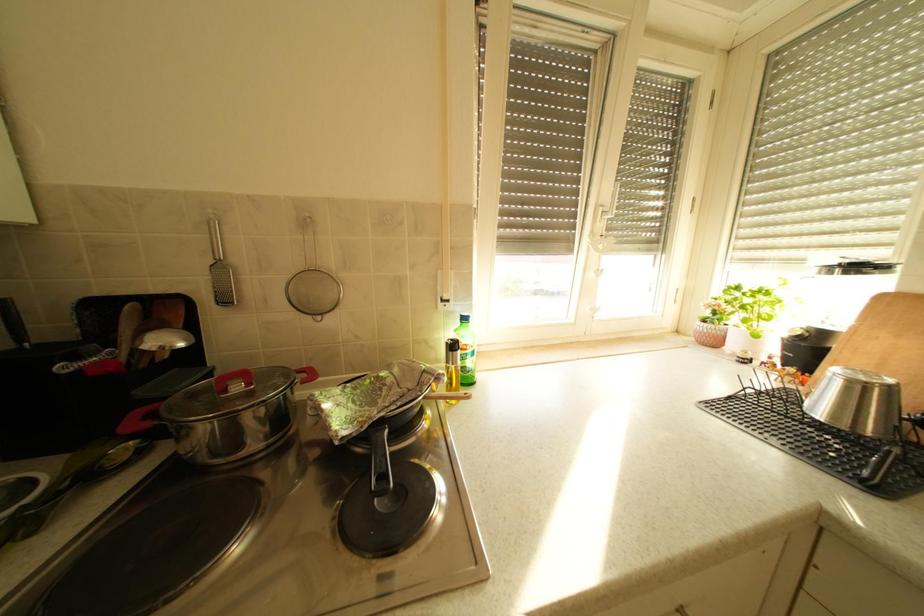
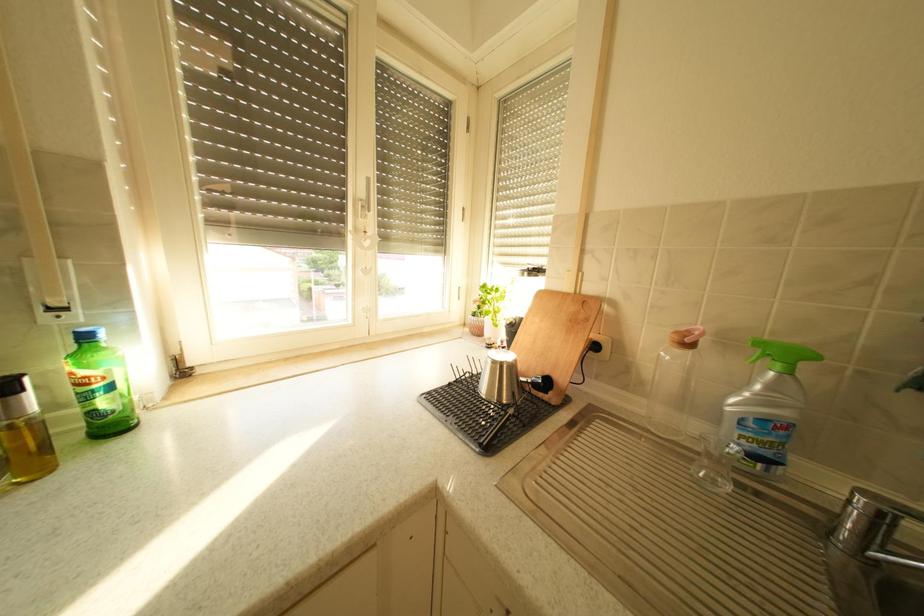
Question: Which direction would the cameraman need to move to produce the second image? Reply with the corresponding letter.

Choices:
 (A) Left
 (B) Right
 (C) Forward
 (D) Backward

Answer: (B)